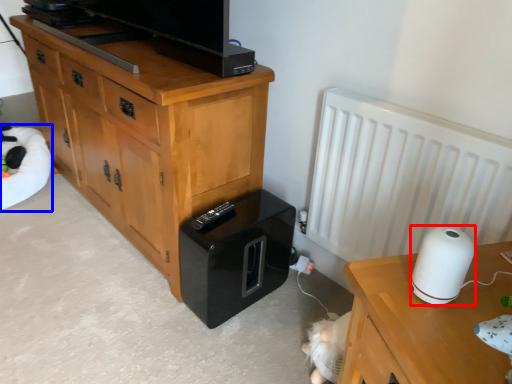
Question: Among these objects, which one is farthest to the camera, appliance (highlighted by a red box) or bean bag chair (highlighted by a blue box)?

Choices:
 (A) appliance
 (B) bean bag chair

Answer: (B)